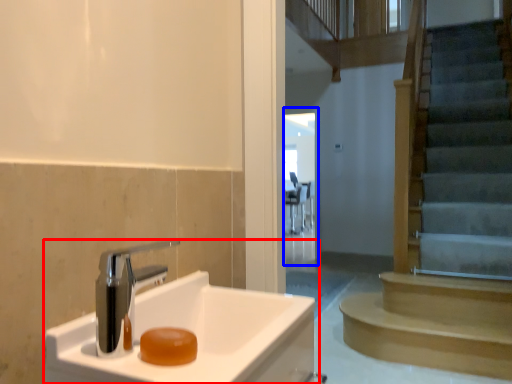
Question: Which object appears farthest to the camera in this image, sink (highlighted by a red box) or glass door (highlighted by a blue box)?

Choices:
 (A) sink
 (B) glass door

Answer: (B)